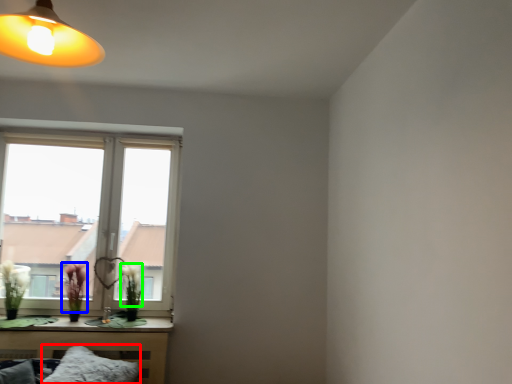
Question: Estimate the real-world distances between objects in this image. Which object is farther from pillow (highlighted by a red box), flower (highlighted by a blue box) or flower (highlighted by a green box)?

Choices:
 (A) flower
 (B) flower

Answer: (B)